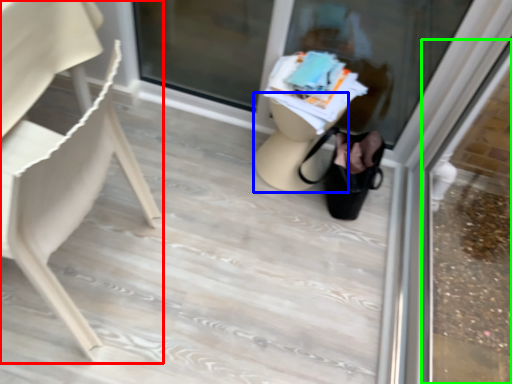
Question: Estimate the real-world distances between objects in this image. Which object is closer to chair (highlighted by a red box), table (highlighted by a blue box) or shop window (highlighted by a green box)?

Choices:
 (A) table
 (B) shop window

Answer: (A)